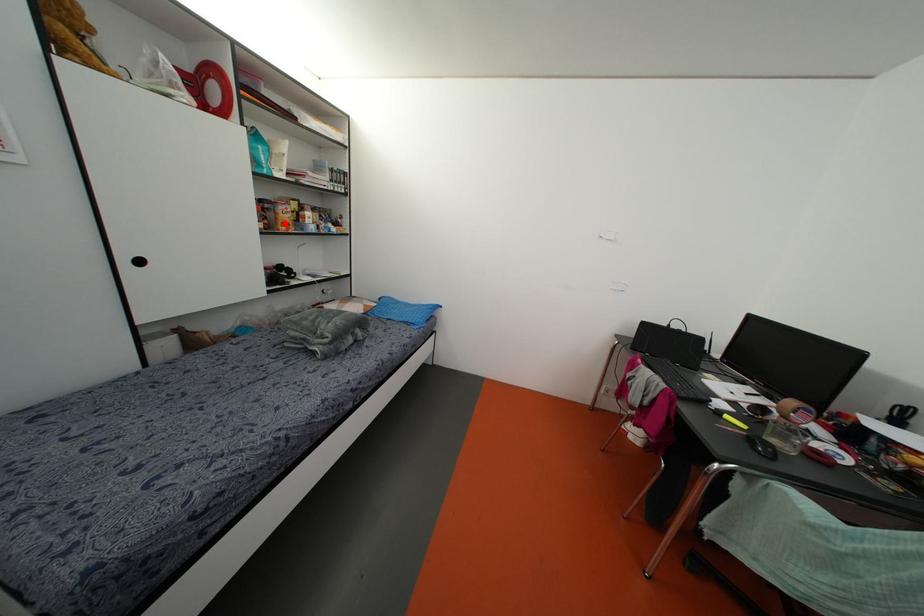
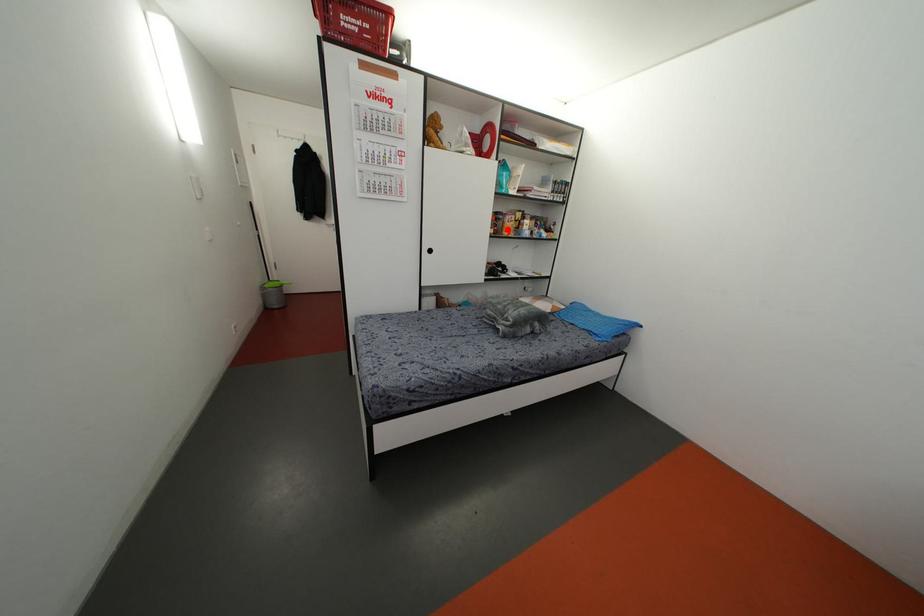
I am providing you with two images of the same scene from different viewpoints. A red point is marked on the first image and another point is marked on the second image. Do the highlighted points in image1 and image2 indicate the same real-world spot?

Yes